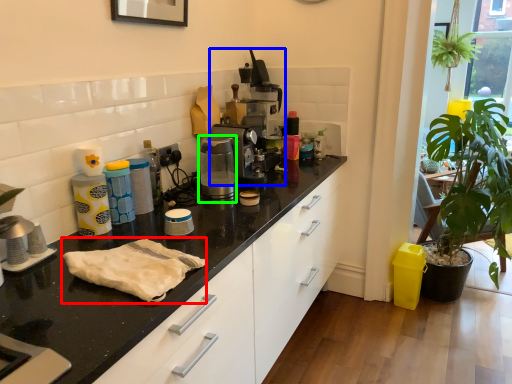
Question: Which object is the closest to the material (highlighted by a red box)? Choose among these: coffee machine (highlighted by a blue box) or coffee machine (highlighted by a green box).

Choices:
 (A) coffee machine
 (B) coffee machine

Answer: (B)